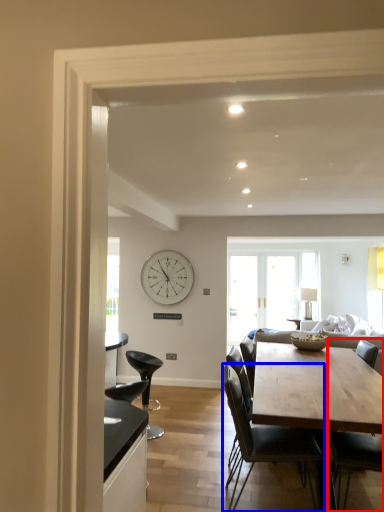
Question: Which object is closer to the camera taking this photo, chair (highlighted by a red box) or chair (highlighted by a blue box)?

Choices:
 (A) chair
 (B) chair

Answer: (A)